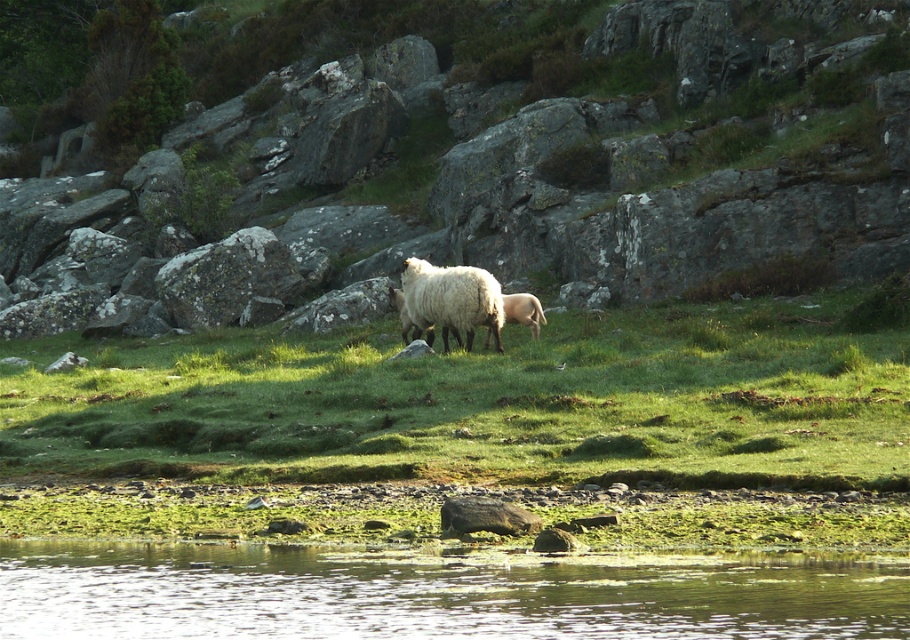
Does clear water at lower center appear on the right side of white woolly sheep at center?

No, clear water at lower center is not to the right of white woolly sheep at center.

How distant is clear water at lower center from white woolly sheep at center?

clear water at lower center is 19.62 meters from white woolly sheep at center.

Identify the location of clear water at lower center. Image resolution: width=910 pixels, height=640 pixels. (440, 593).

Locate an element on the screen. This screenshot has width=910, height=640. clear water at lower center is located at coordinates (440, 593).

Consider the image. How distant is white woolly sheep at center from white woolly lamb at center?

white woolly sheep at center and white woolly lamb at center are 4.03 feet apart from each other.

Is white woolly sheep at center smaller than white woolly lamb at center?

Actually, white woolly sheep at center might be larger than white woolly lamb at center.

Who is more forward, (466, 326) or (504, 300)?

Point (466, 326) is in front.

Locate an element on the screen. This screenshot has width=910, height=640. white woolly sheep at center is located at coordinates (452, 300).

Does green grassy at center appear on the left side of gray rock at center?

No, green grassy at center is not to the left of gray rock at center.

This screenshot has height=640, width=910. What do you see at coordinates (482, 403) in the screenshot? I see `green grassy at center` at bounding box center [482, 403].

Where is `green grassy at center`? The width and height of the screenshot is (910, 640). green grassy at center is located at coordinates (482, 403).